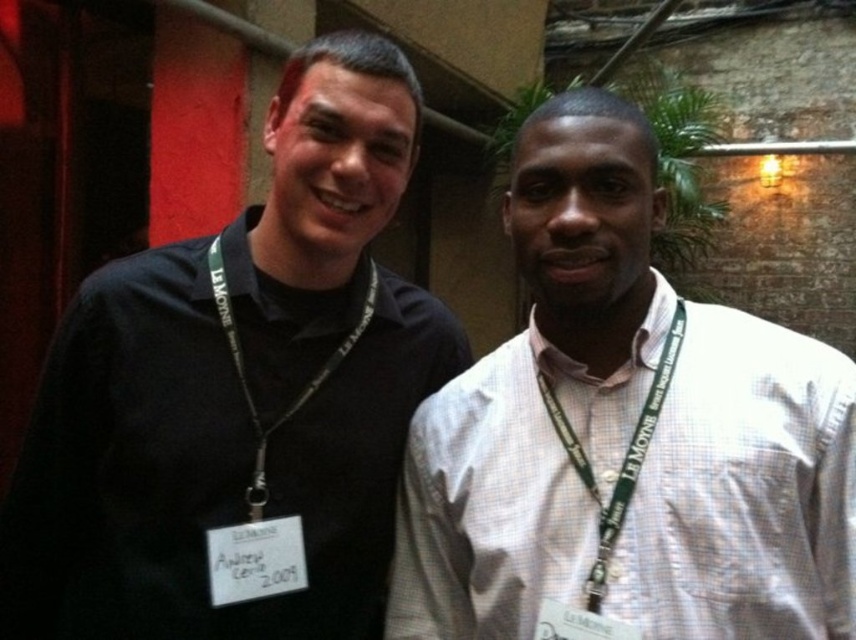
You are an event organizer trying to arrange name tags for attendees. You notice the black matte shirt at left and the green fabric lanyard at center in the image. Which object is positioned higher in the image?

The black matte shirt at left is taller than the green fabric lanyard at center, so the black matte shirt at left is positioned higher in the image.

You are a photographer adjusting the camera focus. You need to ensure both lanyards are in focus. Given that the green fabric lanyard at center and the black fabric lanyard at left are in the frame, which lanyard requires more careful adjustment to keep in focus due to its size?

The green fabric lanyard at center requires more careful adjustment because it occupies less space than the black fabric lanyard at left, making it potentially harder to focus on accurately.

You are a photographer trying to adjust the lighting for a group photo. You need to ensure that both the black matte shirt at left and the white checkered shirt at right are equally visible. Considering their sizes, which shirt might require more light adjustment to ensure proper exposure?

The black matte shirt at left is bigger than the white checkered shirt at right, so it might require more light adjustment to ensure proper exposure since larger objects can cast stronger shadows and may need additional lighting to maintain visibility.